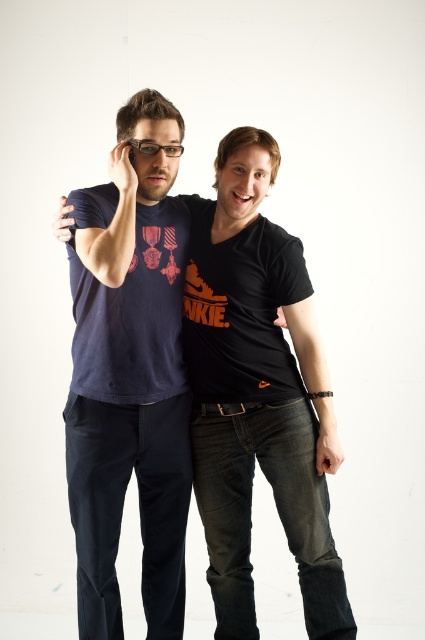
You are a photographer trying to capture a candid shot of the two people in the image. You want to focus on the person closer to the camera. Which point, point 1 at coordinates (122,147) or point 2 at coordinates (275,317), should you aim your camera at to ensure the person closer to the viewer is in focus?

Point 1 at coordinates (122,147) is closer to the viewer than point 2 at coordinates (275,317), so you should aim your camera at point 1 to focus on the person closer to the viewer.